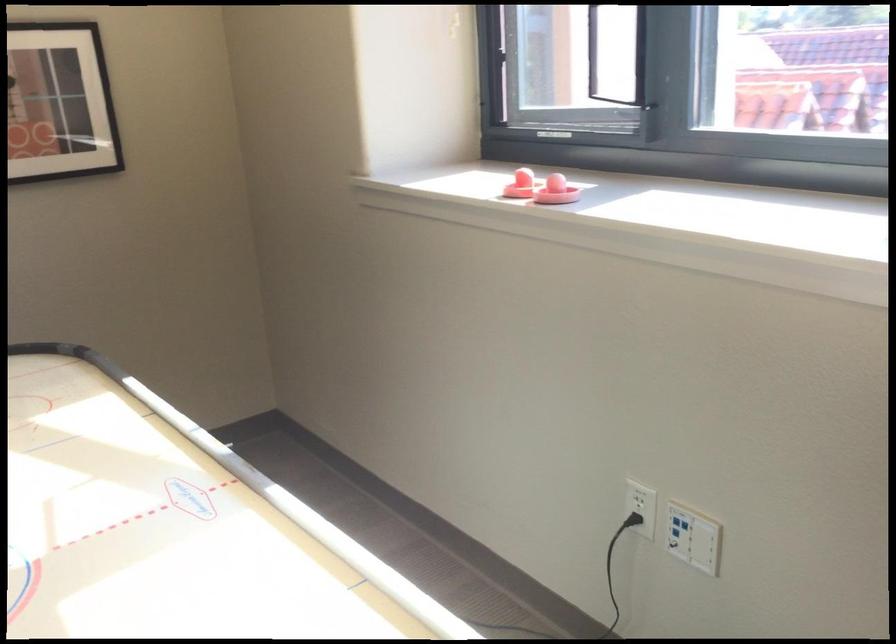
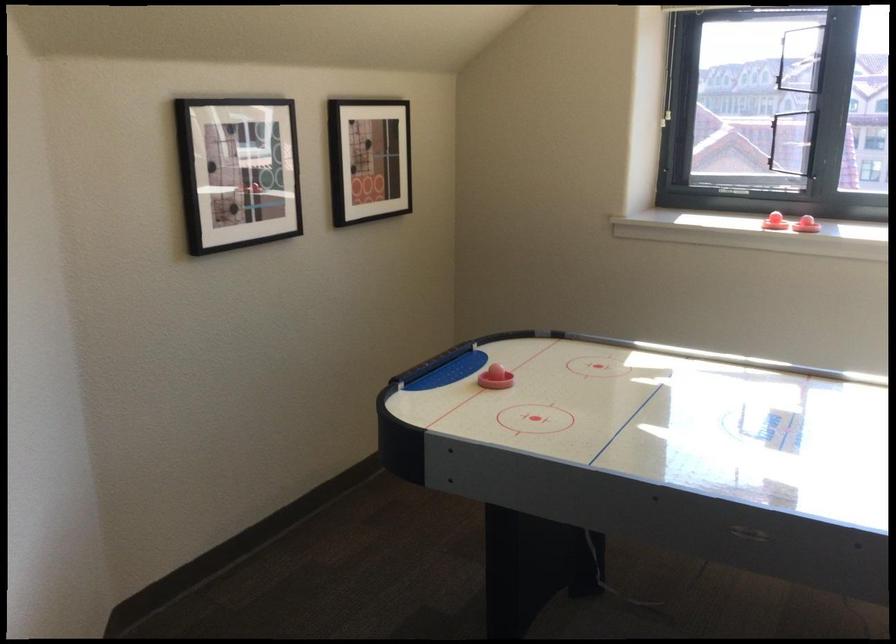
In the second image, find the point that corresponds to (527,211) in the first image.

(806, 225)